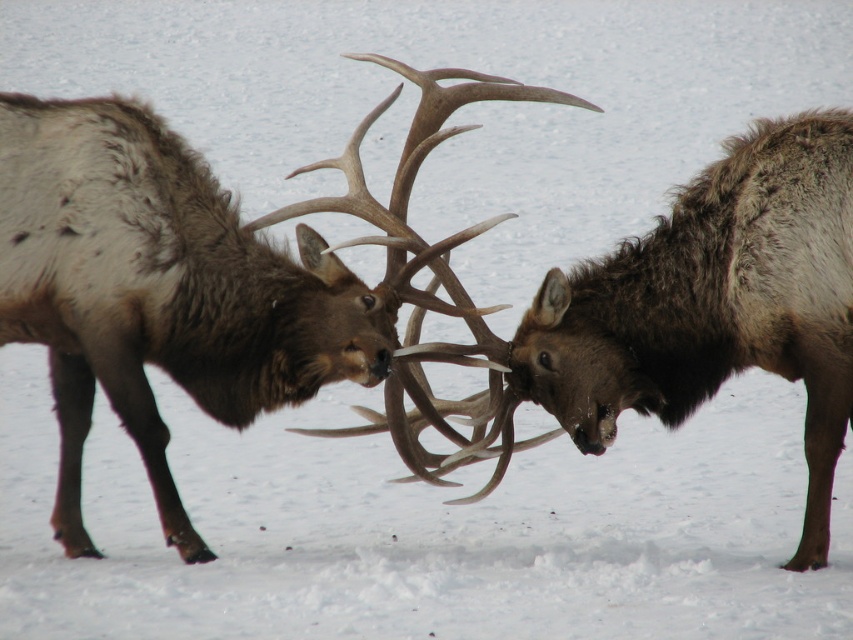
Does brown velvet antlers at center have a lesser width compared to brown fuzzy antlers at center?

No.

Who is positioned more to the right, brown velvet antlers at center or brown fuzzy antlers at center?

From the viewer's perspective, brown fuzzy antlers at center appears more on the right side.

Consider the image. Who is more distant from viewer, (276, 305) or (770, 188)?

The point (276, 305) is more distant.

Locate an element on the screen. brown velvet antlers at center is located at coordinates (202, 276).